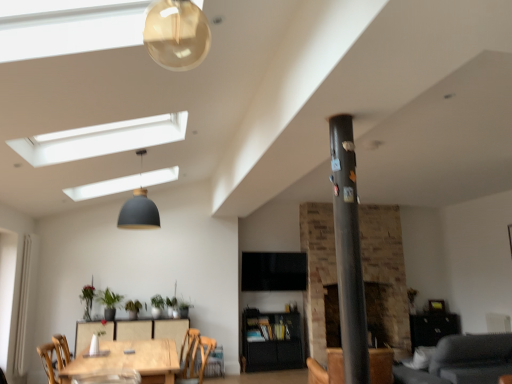
Question: Considering the relative sizes of green leafy plant at center, the third plant viewed from the left, and brown leather armchair at center in the image provided, is green leafy plant at center, the third plant viewed from the left, bigger than brown leather armchair at center?

Choices:
 (A) no
 (B) yes

Answer: (A)

Question: Is green leafy plant at center, the third plant viewed from the left, looking in the opposite direction of brown leather armchair at center?

Choices:
 (A) no
 (B) yes

Answer: (A)

Question: Are green leafy plant at center, the third plant viewed from the left, and brown leather armchair at center far apart?

Choices:
 (A) yes
 (B) no

Answer: (A)

Question: Can you confirm if green leafy plant at center, the third plant viewed from the left, is taller than brown leather armchair at center?

Choices:
 (A) yes
 (B) no

Answer: (B)

Question: Considering the relative sizes of green leafy plant at center, the third plant viewed from the left, and brown leather armchair at center in the image provided, is green leafy plant at center, the third plant viewed from the left, shorter than brown leather armchair at center?

Choices:
 (A) yes
 (B) no

Answer: (A)

Question: From a real-world perspective, is green leafy plant at center, the third plant viewed from the left, positioned above or below wooden chair at lower center?

Choices:
 (A) above
 (B) below

Answer: (A)

Question: In the image, is green leafy plant at center, which ranks as the second plant in right-to-left order, positioned in front of or behind wooden chair at lower center?

Choices:
 (A) front
 (B) behind

Answer: (B)

Question: In the image, is green leafy plant at center, the third plant viewed from the left, on the left side or the right side of wooden chair at lower center?

Choices:
 (A) right
 (B) left

Answer: (B)

Question: From their relative heights in the image, would you say green leafy plant at center, which ranks as the second plant in right-to-left order, is taller or shorter than wooden chair at lower center?

Choices:
 (A) tall
 (B) short

Answer: (B)

Question: Considering the positions of point (84, 286) and point (109, 294), is point (84, 286) closer or farther from the camera than point (109, 294)?

Choices:
 (A) farther
 (B) closer

Answer: (A)

Question: From their relative heights in the image, would you say green matte plant at lower left, placed as the 1th plant when sorted from left to right, is taller or shorter than green matte plant at lower left, acting as the 3th plant starting from the right?

Choices:
 (A) tall
 (B) short

Answer: (A)

Question: Is green matte plant at lower left, placed as the 1th plant when sorted from left to right, spatially inside green matte plant at lower left, acting as the 3th plant starting from the right, or outside of it?

Choices:
 (A) inside
 (B) outside

Answer: (B)

Question: From a real-world perspective, is green matte plant at lower left, placed as the 1th plant when sorted from left to right, physically located above or below green matte plant at lower left, positioned as the second plant in left-to-right order?

Choices:
 (A) above
 (B) below

Answer: (B)

Question: Is point (503, 357) closer or farther from the camera than point (195, 337)?

Choices:
 (A) closer
 (B) farther

Answer: (A)

Question: From a real-world perspective, relative to wooden chair at lower center, is gray fabric couch at lower right vertically above or below?

Choices:
 (A) below
 (B) above

Answer: (A)